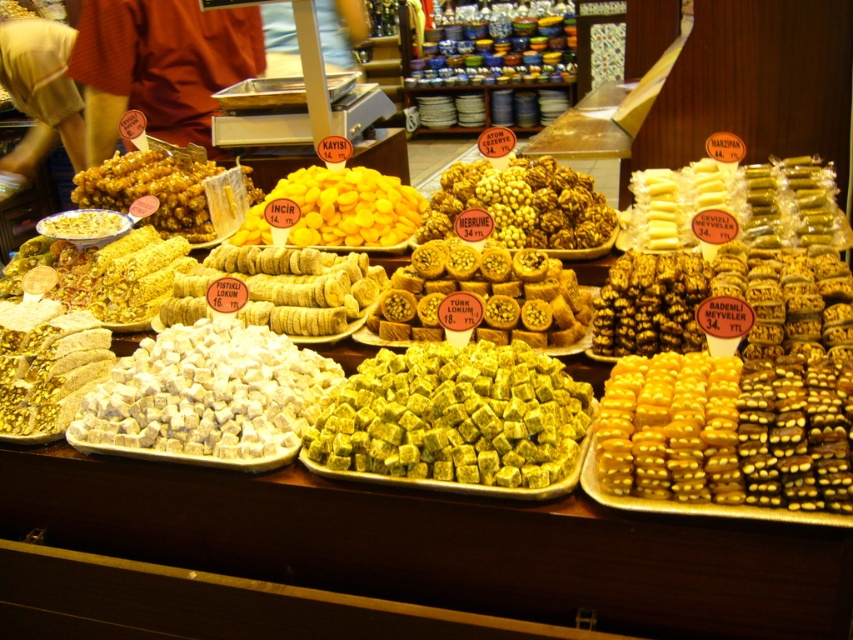
Does yellow crumbly pastry at center appear on the left side of white sugary candy at center?

In fact, yellow crumbly pastry at center is to the right of white sugary candy at center.

Who is more forward, (204, 300) or (25, 394)?

Point (25, 394) is in front.

Locate an element on the screen. The width and height of the screenshot is (853, 640). yellow crumbly pastry at center is located at coordinates 280,289.

Is the position of white soft candy at center less distant than that of yellow matte candy at center?

Yes, it is in front of yellow matte candy at center.

Is white soft candy at center smaller than yellow matte candy at center?

Indeed, white soft candy at center has a smaller size compared to yellow matte candy at center.

The height and width of the screenshot is (640, 853). What do you see at coordinates (207, 396) in the screenshot?
I see `white soft candy at center` at bounding box center [207, 396].

The height and width of the screenshot is (640, 853). I want to click on white soft candy at center, so click(x=207, y=396).

Between point (39, 301) and point (199, 189), which one is positioned behind?

The point (199, 189) is more distant.

Can you confirm if white sugary candy at center is positioned above golden crunchy pastry at center?

Incorrect, white sugary candy at center is not positioned above golden crunchy pastry at center.

Where is `white sugary candy at center`? white sugary candy at center is located at coordinates (47, 365).

Identify the location of white sugary candy at center. (x=47, y=365).